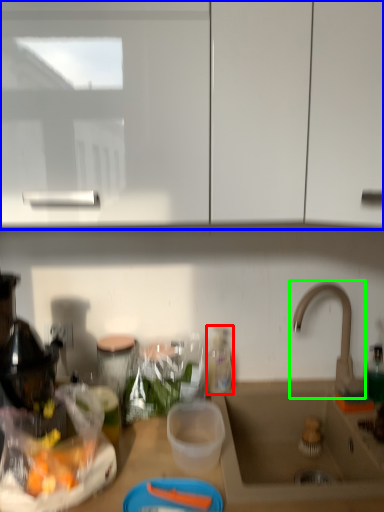
Question: Which object is positioned closest to bottle (highlighted by a red box)? Select from cabinetry (highlighted by a blue box) and tap (highlighted by a green box).

Choices:
 (A) cabinetry
 (B) tap

Answer: (B)